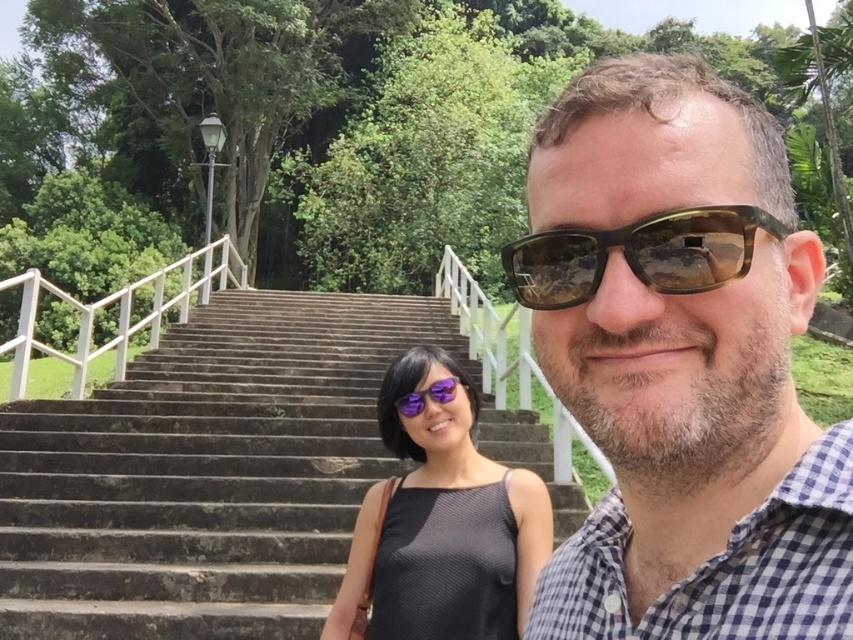
Which is more to the left, brown checkered shirt at center or matte black tank top at center?

Positioned to the left is matte black tank top at center.

This screenshot has width=853, height=640. I want to click on brown checkered shirt at center, so click(682, 364).

Between point (699, 412) and point (427, 602), which one is positioned in front?

Point (699, 412) is in front.

Locate an element on the screen. brown checkered shirt at center is located at coordinates (682, 364).

Based on the photo, can you confirm if stone stairs at center is taller than matte black tank top at center?

No, stone stairs at center is not taller than matte black tank top at center.

The height and width of the screenshot is (640, 853). What do you see at coordinates (206, 472) in the screenshot? I see `stone stairs at center` at bounding box center [206, 472].

Where is `stone stairs at center`? This screenshot has height=640, width=853. stone stairs at center is located at coordinates pyautogui.click(x=206, y=472).

Which of these two, brown checkered shirt at center or brown translucent goggles at center, stands taller?

With more height is brown checkered shirt at center.

Is brown checkered shirt at center in front of brown translucent goggles at center?

Yes, brown checkered shirt at center is closer to the viewer.

Is point (666, 572) behind point (692, 282)?

Yes, point (666, 572) is behind point (692, 282).

Locate an element on the screen. This screenshot has height=640, width=853. brown checkered shirt at center is located at coordinates (682, 364).